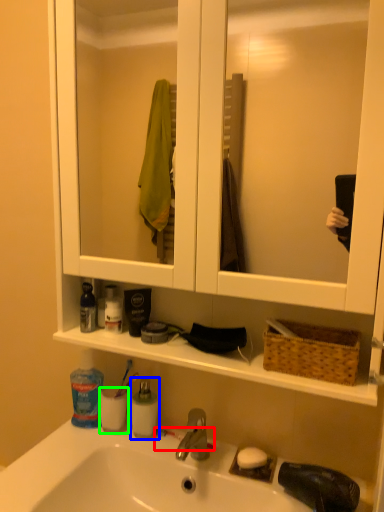
Question: Which object is positioned closest to toothbrush (highlighted by a red box)? Select from mouthwash (highlighted by a blue box) and mouthwash (highlighted by a green box).

Choices:
 (A) mouthwash
 (B) mouthwash

Answer: (A)